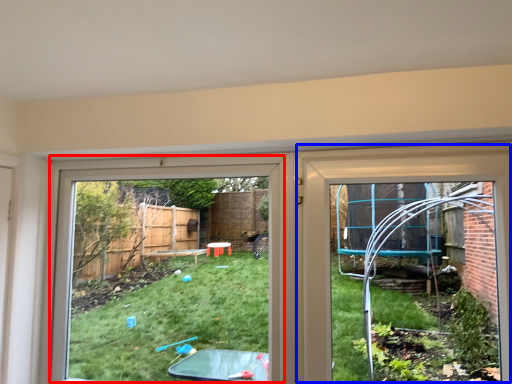
Question: Among these objects, which one is farthest to the camera, bay window (highlighted by a red box) or door (highlighted by a blue box)?

Choices:
 (A) bay window
 (B) door

Answer: (A)